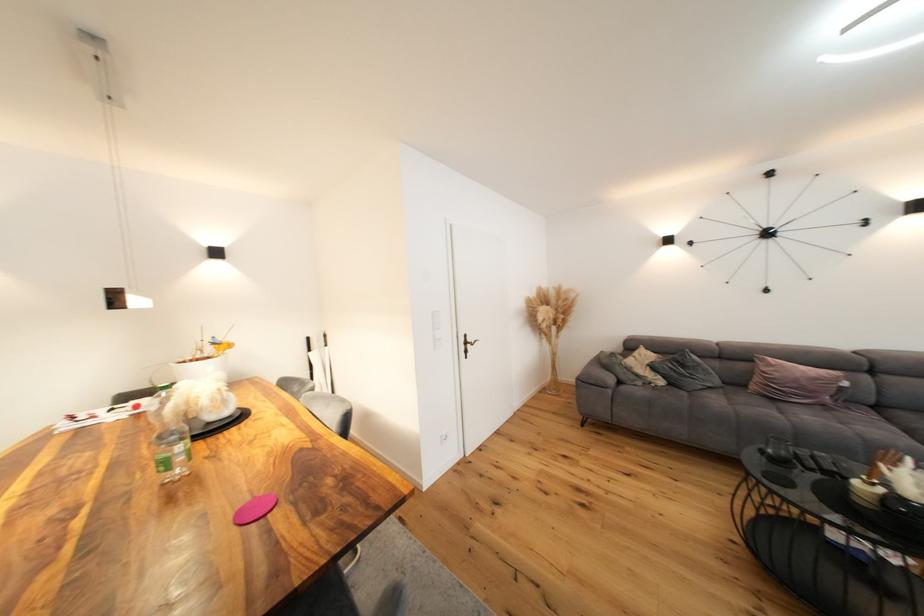
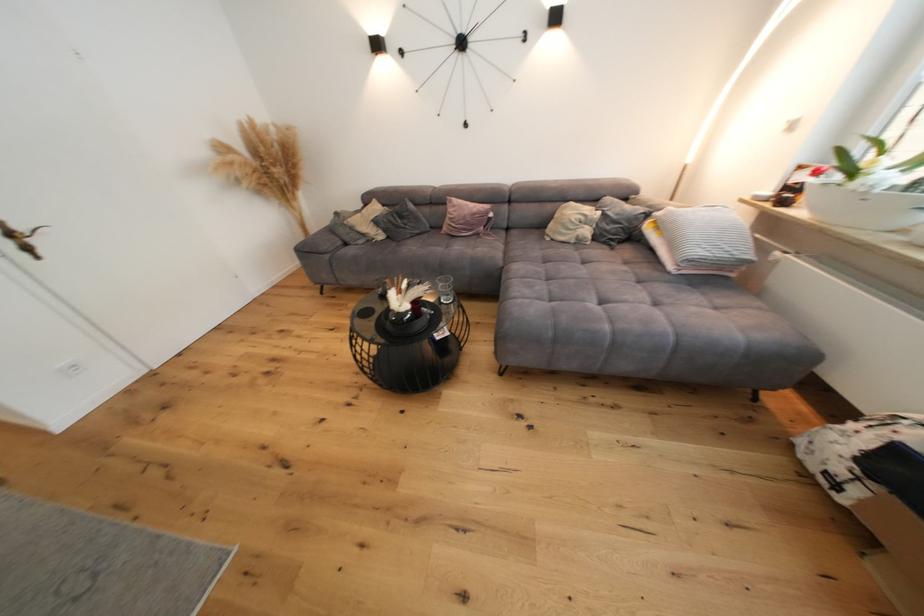
Locate, in the second image, the point that corresponds to (x=629, y=379) in the first image.

(354, 240)